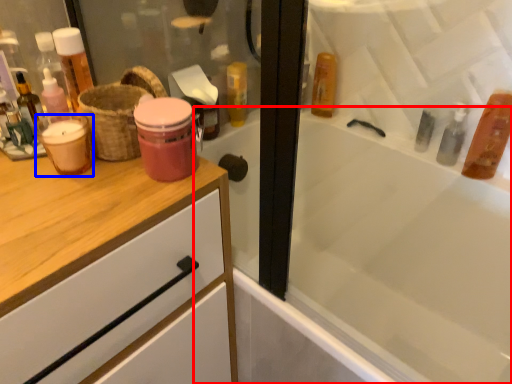
Question: Which point is closer to the camera, bathtub (highlighted by a red box) or mouthwash (highlighted by a blue box)?

Choices:
 (A) bathtub
 (B) mouthwash

Answer: (A)